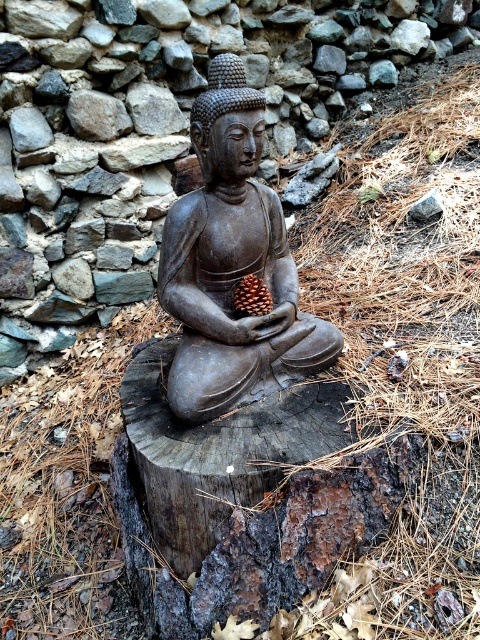
The width and height of the screenshot is (480, 640). In order to click on matte brown statue at center in this screenshot , I will do `click(232, 264)`.

Is point (262, 132) positioned before point (265, 294)?

Yes, it is.

Identify the location of matte brown statue at center. (232, 264).

Between point (19, 179) and point (171, 248), which one is positioned behind?

Point (19, 179)

Is matte gray statue at center taller than matte brown statue at center?

Indeed, matte gray statue at center has a greater height compared to matte brown statue at center.

Which is behind, point (117, 285) or point (186, 371)?

The point (117, 285) is behind.

The width and height of the screenshot is (480, 640). What are the coordinates of `matte gray statue at center` in the screenshot? It's located at (159, 125).

Between matte gray statue at center and brown matte pine cone at center, which one has more height?

Standing taller between the two is matte gray statue at center.

Who is more forward, (52,104) or (242,292)?

Positioned in front is point (242,292).

Is point (80, 198) behind point (252, 307)?

Yes, it is.

Locate an element on the screen. matte gray statue at center is located at coordinates (159, 125).